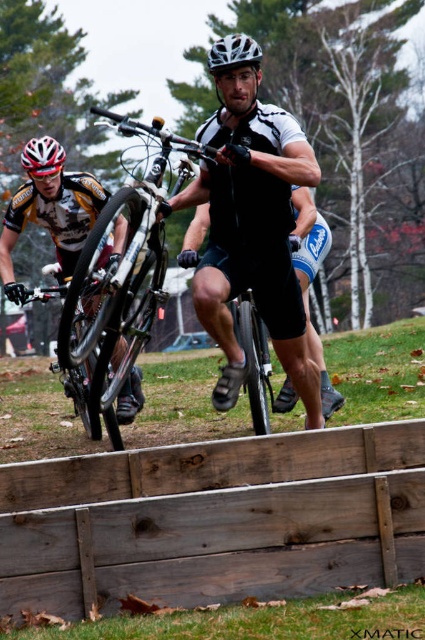
Question: Can you confirm if wooden fence at lower center is bigger than shiny silver bicycle at center?

Choices:
 (A) no
 (B) yes

Answer: (A)

Question: Which is nearer to the white matte bicycle helmet at center?

Choices:
 (A) shiny silver bicycle at center
 (B) wooden fence at lower center

Answer: (A)

Question: Is shiny silver bicycle at center to the right of white matte bicycle helmet at upper left from the viewer's perspective?

Choices:
 (A) no
 (B) yes

Answer: (B)

Question: Estimate the real-world distances between objects in this image. Which object is closer to the shiny silver bicycle at center?

Choices:
 (A) white matte helmet at center
 (B) white matte bicycle helmet at upper left

Answer: (B)

Question: Among these objects, which one is farthest from the camera?

Choices:
 (A) white matte bicycle helmet at center
 (B) wooden fence at lower center

Answer: (A)

Question: Can you confirm if silver metallic mountain bike at center is positioned above white matte helmet at center?

Choices:
 (A) yes
 (B) no

Answer: (B)